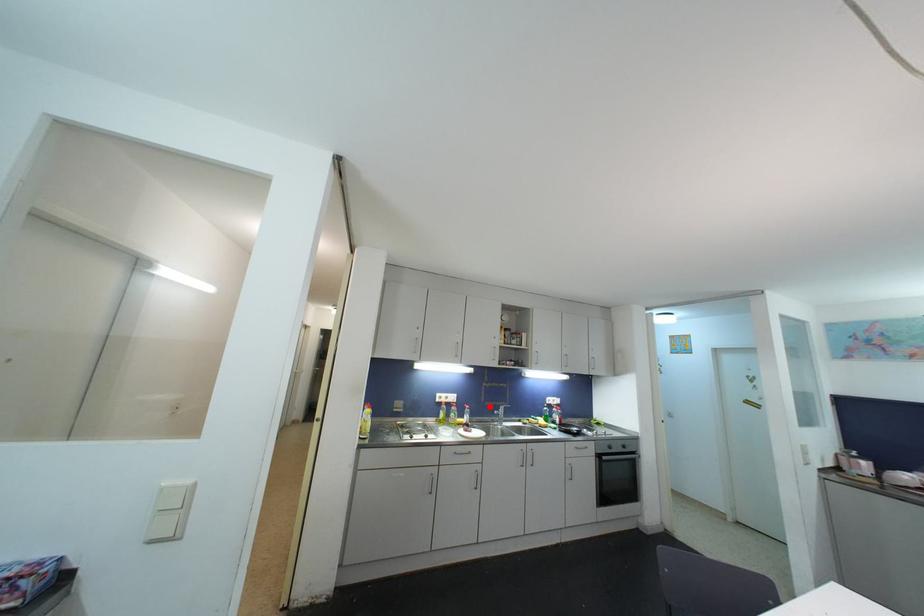
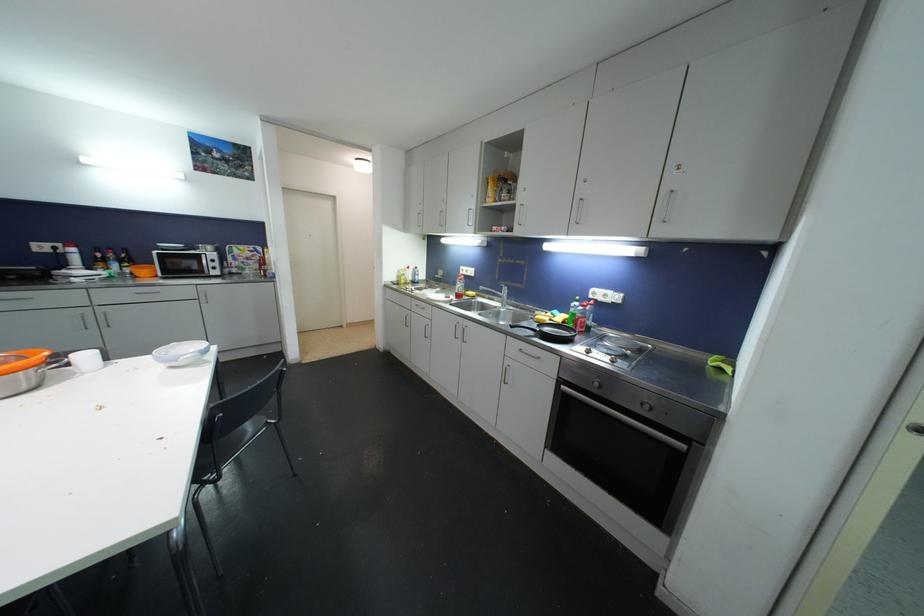
Question: I am providing you with two images of the same scene from different viewpoints. In image1, a red point is highlighted. Considering the same 3D point in image2, which of the following is correct?

Choices:
 (A) It is closer
 (B) It is farther

Answer: (A)